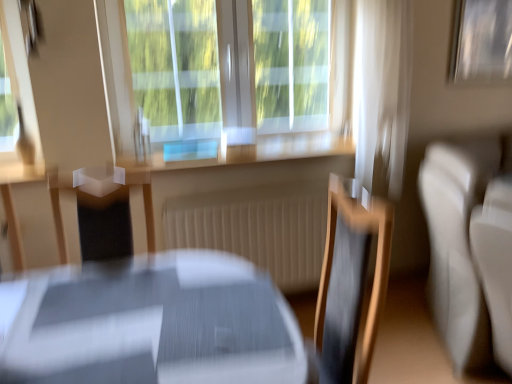
Question: Can you confirm if white sheer curtain at upper right is positioned to the left of transparent glass window at center?

Choices:
 (A) no
 (B) yes

Answer: (A)

Question: From the image's perspective, is white sheer curtain at upper right located above transparent glass window at center?

Choices:
 (A) yes
 (B) no

Answer: (B)

Question: Is white sheer curtain at upper right shorter than transparent glass window at center?

Choices:
 (A) yes
 (B) no

Answer: (B)

Question: Considering the relative sizes of white sheer curtain at upper right and transparent glass window at center in the image provided, is white sheer curtain at upper right taller than transparent glass window at center?

Choices:
 (A) no
 (B) yes

Answer: (B)

Question: Does white sheer curtain at upper right come in front of transparent glass window at center?

Choices:
 (A) no
 (B) yes

Answer: (B)

Question: Is white leather couch at right in front of or behind metallic silver picture frame at upper right, which is the second picture frame from front to back, in the image?

Choices:
 (A) behind
 (B) front

Answer: (B)

Question: Is white leather couch at right inside the boundaries of metallic silver picture frame at upper right, arranged as the second picture frame when viewed from the left, or outside?

Choices:
 (A) outside
 (B) inside

Answer: (A)

Question: In terms of width, does white leather couch at right look wider or thinner when compared to metallic silver picture frame at upper right, which is counted as the 1th picture frame, starting from the right?

Choices:
 (A) wide
 (B) thin

Answer: (A)

Question: From the image's perspective, relative to metallic silver picture frame at upper right, marked as the first picture frame in a back-to-front arrangement, is white leather couch at right above or below?

Choices:
 (A) above
 (B) below

Answer: (B)

Question: In terms of height, does white sheer curtain at upper right look taller or shorter compared to metallic silver picture frame at upper left, acting as the second picture frame starting from the back?

Choices:
 (A) short
 (B) tall

Answer: (B)

Question: Does point (367, 1) appear closer or farther from the camera than point (29, 54)?

Choices:
 (A) farther
 (B) closer

Answer: (A)

Question: Is white sheer curtain at upper right spatially inside metallic silver picture frame at upper left, arranged as the first picture frame when viewed from the left, or outside of it?

Choices:
 (A) outside
 (B) inside

Answer: (A)

Question: In the image, is white sheer curtain at upper right on the left side or the right side of metallic silver picture frame at upper left, arranged as the first picture frame when viewed from the left?

Choices:
 (A) right
 (B) left

Answer: (A)

Question: From a real-world perspective, is metallic silver picture frame at upper right, marked as the first picture frame in a back-to-front arrangement, physically located above or below matte gray table at center?

Choices:
 (A) above
 (B) below

Answer: (A)

Question: In terms of width, does metallic silver picture frame at upper right, which is counted as the 1th picture frame, starting from the right, look wider or thinner when compared to matte gray table at center?

Choices:
 (A) wide
 (B) thin

Answer: (B)